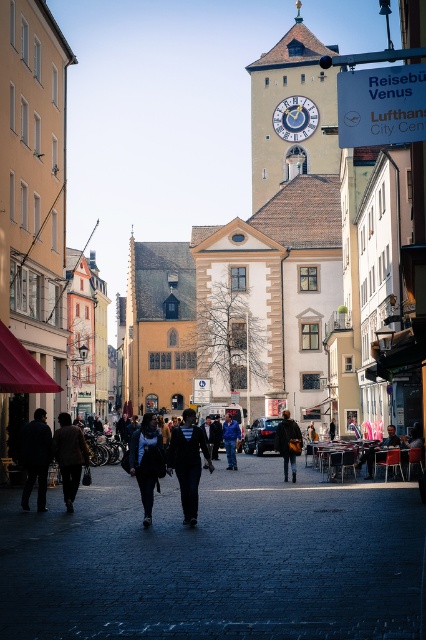
In the scene shown: You are standing in the city square and want to take a photo of both the point at coordinates (43, 540) and the point at coordinates (222, 433). Which point should you focus on first to ensure both are in the frame?

You should focus on point (43, 540) first because it is closer to you than point (222, 433), ensuring both points are within the camera frame.

You are standing in the city square looking at the clock tower and two points marked in the image. The points are labeled as point (400, 504) and point (291, 100). Which point is closer to your current position?

Point (400, 504) is closer to the camera than point (291, 100), so the point closer to your current position is point (400, 504).